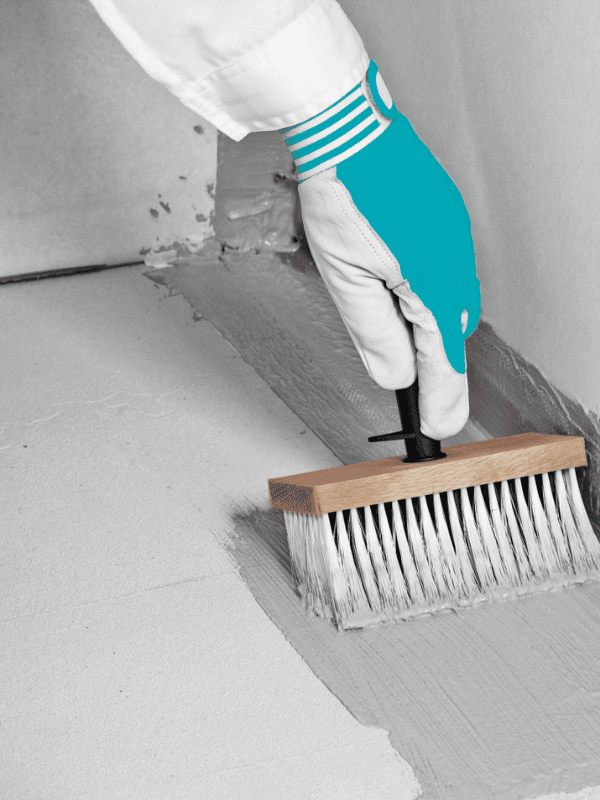
This screenshot has width=600, height=800. I want to click on drywall, so click(548, 122).